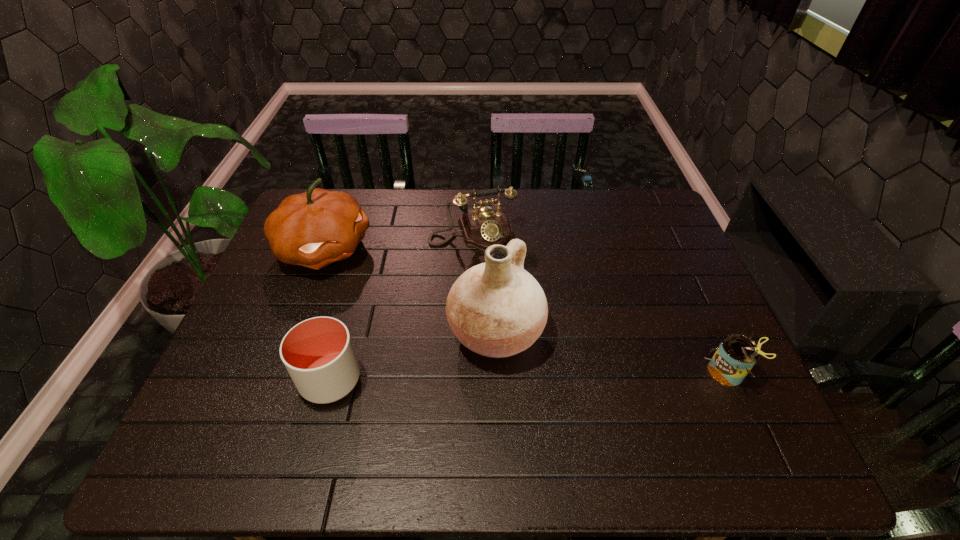
At what (x,y) coordinates should I click in order to perform the action: click on cup. Please return your answer as a coordinate pair (x, y). Looking at the image, I should click on (318, 353).

This screenshot has width=960, height=540. What are the coordinates of `the rightmost object` in the screenshot? It's located at (736, 355).

Locate an element on the screen. This screenshot has height=540, width=960. the tallest object is located at coordinates (497, 309).

The width and height of the screenshot is (960, 540). Find the location of `pumpkin`. pumpkin is located at coordinates (313, 229).

Identify the location of telephone. (482, 227).

Identify the location of free space located 0.080m on the right of the cup. [396, 379].

Locate an element on the screen. vacant space located 0.340m on the left of the can is located at coordinates (560, 373).

Locate an element on the screen. vacant space located 0.100m to pour from the handle of the pottery is located at coordinates (578, 371).

Locate an element on the screen. The width and height of the screenshot is (960, 540). vacant space situated to pour from the handle of the pottery is located at coordinates (566, 366).

Where is `vacant space located to pour from the handle of the pottery`? The image size is (960, 540). vacant space located to pour from the handle of the pottery is located at coordinates (646, 403).